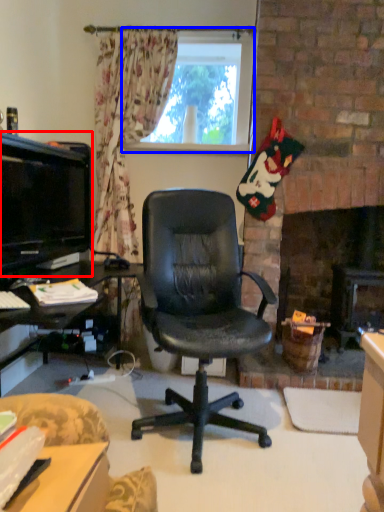
Question: Which object appears farthest to the camera in this image, television (highlighted by a red box) or window (highlighted by a blue box)?

Choices:
 (A) television
 (B) window

Answer: (B)